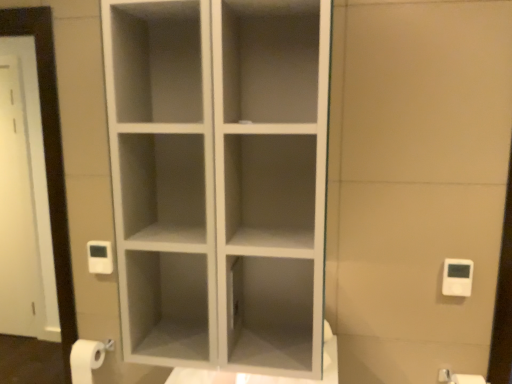
What are the coordinates of `white plastic light switch at right` in the screenshot? It's located at (457, 277).

This screenshot has width=512, height=384. What do you see at coordinates (457, 277) in the screenshot? I see `white plastic light switch at right` at bounding box center [457, 277].

You are a GUI agent. You are given a task and a screenshot of the screen. Output one action in this format:
    pyautogui.click(x=<x>, y=<y>)
    Task: Click on the white matte toilet paper at lower right
    
    Given the screenshot: What is the action you would take?
    pyautogui.click(x=459, y=378)

Describe the element at coordinates (459, 378) in the screenshot. I see `white matte toilet paper at lower right` at that location.

The height and width of the screenshot is (384, 512). In order to click on white plastic light switch at right in this screenshot , I will do `click(457, 277)`.

Is white plastic light switch at right to the right of white matte toilet paper at lower right from the viewer's perspective?

No.

Is the depth of white plastic light switch at right greater than that of white matte toilet paper at lower right?

Yes.

Is point (442, 287) positioned behind point (483, 380)?

No.

From the image's perspective, relative to white matte toilet paper at lower right, is white plastic light switch at right above or below?

white plastic light switch at right is situated higher than white matte toilet paper at lower right in the image.

From a real-world perspective, is white plastic light switch at right located higher than white matte toilet paper at lower right?

Yes, from a real-world perspective, white plastic light switch at right is over white matte toilet paper at lower right

Considering the sizes of objects white plastic light switch at right and white matte toilet paper at lower right in the image provided, who is wider, white plastic light switch at right or white matte toilet paper at lower right?

white matte toilet paper at lower right.

Considering the sizes of white plastic light switch at right and white matte toilet paper at lower right in the image, is white plastic light switch at right taller or shorter than white matte toilet paper at lower right?

white plastic light switch at right is shorter than white matte toilet paper at lower right.

In terms of size, does white plastic light switch at right appear bigger or smaller than white matte toilet paper at lower right?

Clearly, white plastic light switch at right is smaller in size than white matte toilet paper at lower right.

Would you say white plastic light switch at right is outside white matte toilet paper at lower right?

Indeed, white plastic light switch at right is completely outside white matte toilet paper at lower right.

Is white plastic light switch at right far away from white matte toilet paper at lower right?

No, white plastic light switch at right is not far away from white matte toilet paper at lower right.

Is white plastic light switch at right facing away from white matte toilet paper at lower right?

white plastic light switch at right does not have its back to white matte toilet paper at lower right.

At what (x,y) coordinates should I click in order to perform the action: click on light switch on the left of white matte toilet paper at lower right. Please return your answer as a coordinate pair (x, y). The image size is (512, 384). Looking at the image, I should click on (457, 277).

Can you confirm if white matte toilet paper at lower right is positioned to the left of white plastic light switch at right?

Incorrect, white matte toilet paper at lower right is not on the left side of white plastic light switch at right.

Who is more distant, white matte toilet paper at lower right or white plastic light switch at right?

white plastic light switch at right is further from the camera.

Considering the points (479, 379) and (445, 259), which point is in front, point (479, 379) or point (445, 259)?

Point (445, 259)

From the image's perspective, is white matte toilet paper at lower right positioned above or below white plastic light switch at right?

Based on their image positions, white matte toilet paper at lower right is located beneath white plastic light switch at right.

From a real-world perspective, is white matte toilet paper at lower right positioned above or below white plastic light switch at right?

white matte toilet paper at lower right is below white plastic light switch at right.

Between white matte toilet paper at lower right and white plastic light switch at right, which one has larger width?

Wider between the two is white matte toilet paper at lower right.

Considering the sizes of white matte toilet paper at lower right and white plastic light switch at right in the image, is white matte toilet paper at lower right taller or shorter than white plastic light switch at right?

Clearly, white matte toilet paper at lower right is taller compared to white plastic light switch at right.

Considering the relative sizes of white matte toilet paper at lower right and white plastic light switch at right in the image provided, is white matte toilet paper at lower right bigger than white plastic light switch at right?

Indeed, white matte toilet paper at lower right has a larger size compared to white plastic light switch at right.

Can we say white matte toilet paper at lower right lies outside white plastic light switch at right?

Yes.

Is white matte toilet paper at lower right positioned far away from white plastic light switch at right?

Actually, white matte toilet paper at lower right and white plastic light switch at right are a little close together.

Is white matte toilet paper at lower right facing towards white plastic light switch at right?

No, white matte toilet paper at lower right is not aimed at white plastic light switch at right.

Can you tell me how much white matte toilet paper at lower right and white plastic light switch at right differ in facing direction?

The angle between the facing direction of white matte toilet paper at lower right and the facing direction of white plastic light switch at right is 2.06 degrees.

How much distance is there between white matte toilet paper at lower right and white plastic light switch at right?

white matte toilet paper at lower right and white plastic light switch at right are 14.27 inches apart from each other.

At what (x,y) coordinates should I click in order to perform the action: click on toilet paper lying on the right of white plastic light switch at right. Please return your answer as a coordinate pair (x, y). Looking at the image, I should click on [459, 378].

The height and width of the screenshot is (384, 512). I want to click on light switch above the white matte toilet paper at lower right (from the image's perspective), so click(x=457, y=277).

Find the location of a particular element. light switch that is above the white matte toilet paper at lower right (from a real-world perspective) is located at coordinates (457, 277).